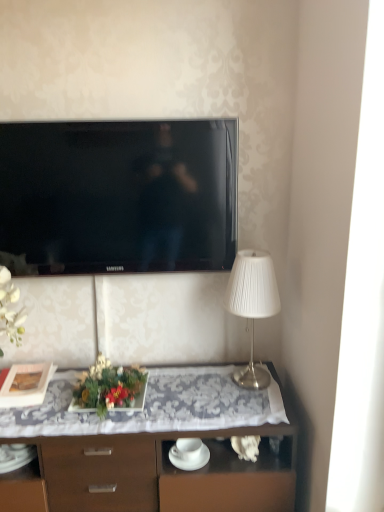
This screenshot has height=512, width=384. In order to click on free location to the left of white pleated fabric lampshade at right in this screenshot , I will do `click(196, 391)`.